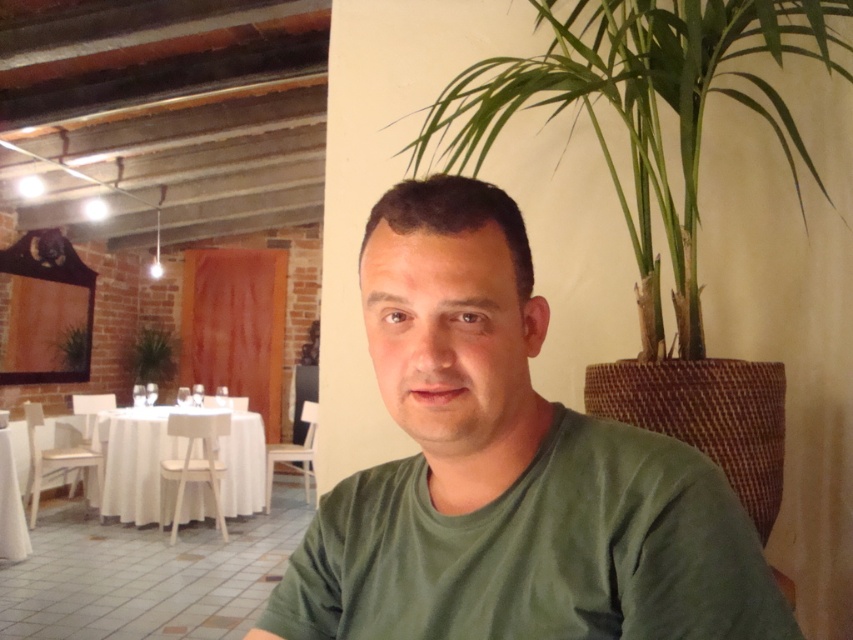
You are a photographer taking a picture of the dining area. You notice the green cotton shirt at center and the green leafy plant at left. Which object is taller?

The green cotton shirt at center is taller than the green leafy plant at left according to the description.

You are a customer in this restaurant and want to place your coat on the nearest available surface. The only surfaces available are the table in front of you and the surface at point (x=642, y=109). Which surface is closer to you?

The surface at point (x=642, y=109) is the green leafy plant at upper right, which is farther away than the table in front of you, so the table in front of you is closer.

You are a customer entering the restaurant and want to sit at the table closest to the entrance. The entrance is near the wooden door visible in the midground. Which direction should you walk relative to the green cotton shirt at center?

Since the wooden door is in the midground and the green cotton shirt at center is positioned at coordinates point (508, 472), you should walk towards the direction of the wooden door, which is likely to the left or right depending on the shirt position. However, without exact coordinates for the door, it is difficult to determine the exact direction. Please refer to the scene description for guidance.